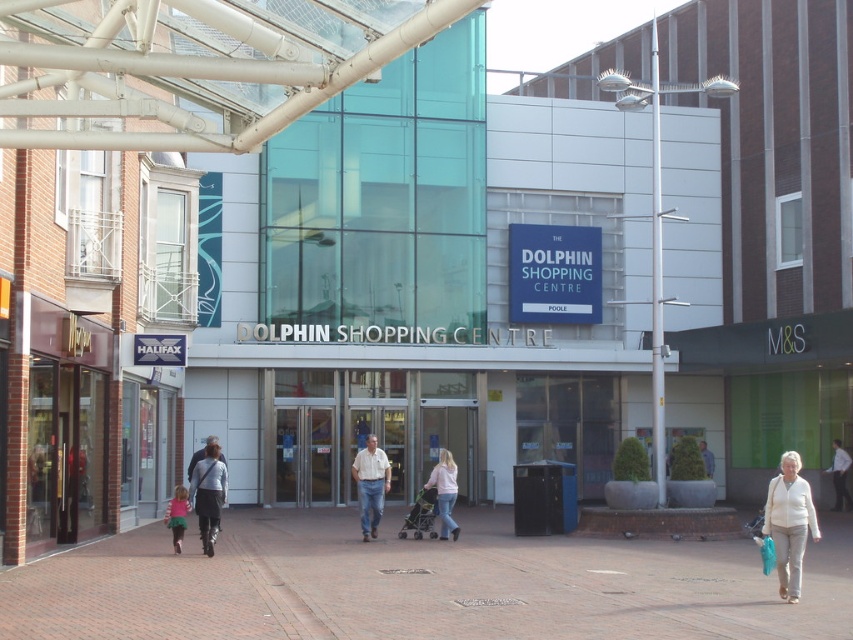
Question: Estimate the real-world distances between objects in this image. Which object is farther from the dark gray sweater at lower left?

Choices:
 (A) light pink fabric stroller at center
 (B) light blue shirt at center
 (C) white shirt at center

Answer: (C)

Question: Is dark gray sweater at lower left wider than light pink fabric stroller at center?

Choices:
 (A) yes
 (B) no

Answer: (A)

Question: Can you confirm if light beige sweater at lower right is wider than dark gray sweater at lower left?

Choices:
 (A) yes
 (B) no

Answer: (A)

Question: Is white shirt at center further to camera compared to matte pink dress at lower left?

Choices:
 (A) no
 (B) yes

Answer: (B)

Question: Which point appears farthest from the camera in this image?

Choices:
 (A) pyautogui.click(x=445, y=497)
 (B) pyautogui.click(x=833, y=474)

Answer: (B)

Question: Which object is farther from the camera taking this photo?

Choices:
 (A) white shirt at center
 (B) brick pavement at center
 (C) light beige shirt at center
 (D) matte pink dress at lower left

Answer: (A)